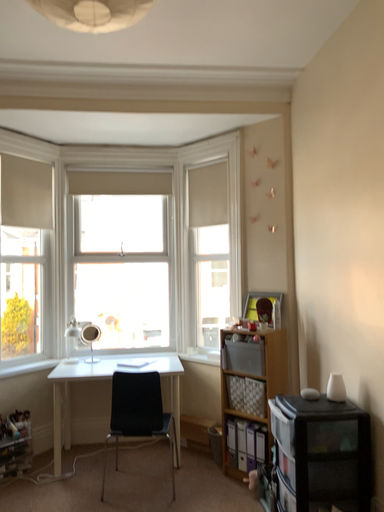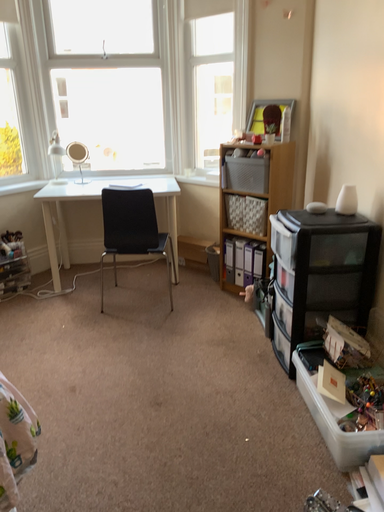
Question: How did the camera likely rotate when shooting the video?

Choices:
 (A) rotated upward
 (B) rotated downward

Answer: (B)